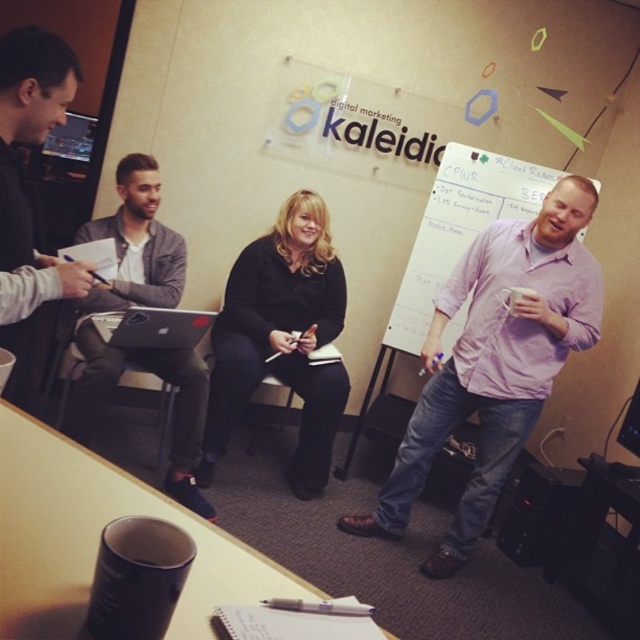
Can you confirm if black matte jacket at center is positioned to the left of matte black laptop at left?

Incorrect, black matte jacket at center is not on the left side of matte black laptop at left.

Who is positioned more to the left, black matte jacket at center or matte black laptop at left?

Positioned to the left is matte black laptop at left.

Where is `black matte jacket at center`? The width and height of the screenshot is (640, 640). black matte jacket at center is located at coordinates (282, 339).

Does purple cotton shirt at right appear on the left side of brushed metal laptop at left?

Incorrect, purple cotton shirt at right is not on the left side of brushed metal laptop at left.

Which of these two, purple cotton shirt at right or brushed metal laptop at left, stands taller?

purple cotton shirt at right is taller.

Between point (550, 227) and point (176, 442), which one is positioned in front?

Point (550, 227) is in front.

Locate an element on the screen. purple cotton shirt at right is located at coordinates click(493, 362).

Can you confirm if black matte jacket at center is shorter than satin black laptop at center?

Incorrect, black matte jacket at center's height does not fall short of satin black laptop at center's.

Locate an element on the screen. Image resolution: width=640 pixels, height=640 pixels. black matte jacket at center is located at coordinates (282, 339).

Identify the location of black matte jacket at center. This screenshot has height=640, width=640. (282, 339).